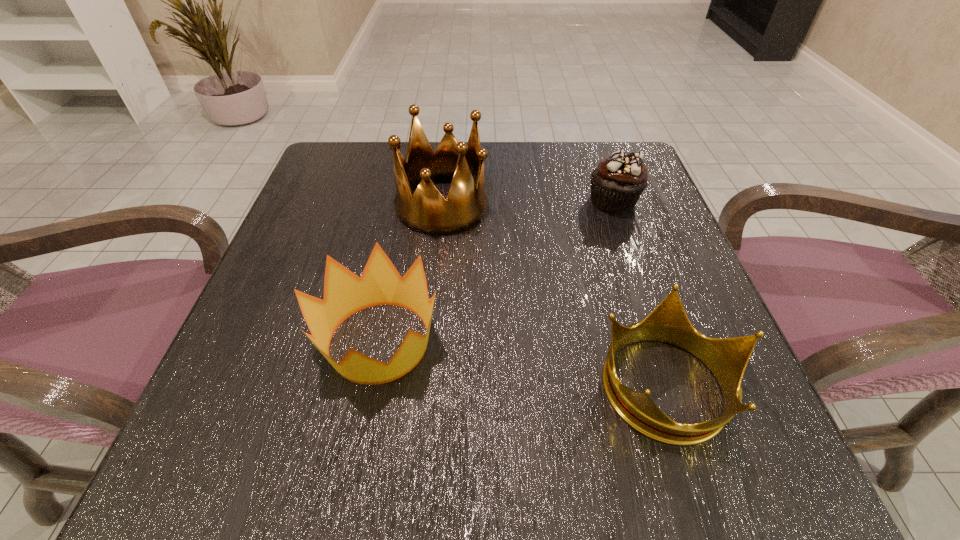
This screenshot has height=540, width=960. I want to click on vacant space at the near right corner, so click(653, 478).

You are a GUI agent. You are given a task and a screenshot of the screen. Output one action in this format:
    pyautogui.click(x=<x>, y=<y>)
    Task: Click on the free point between the cupcake and the rightmost crown
    
    Given the screenshot: What is the action you would take?
    pyautogui.click(x=639, y=292)

Find the location of a particular element. free area in between the cupcake and the rightmost crown is located at coordinates (639, 292).

The image size is (960, 540). I want to click on free spot between the rightmost crown and the cupcake, so click(639, 292).

You are a GUI agent. You are given a task and a screenshot of the screen. Output one action in this format:
    pyautogui.click(x=<x>, y=<y>)
    Task: Click on the unoccupied position between the cupcake and the farthest crown
    
    Given the screenshot: What is the action you would take?
    pyautogui.click(x=527, y=203)

Find the location of a particular element. This screenshot has width=960, height=540. vacant point located between the rightmost crown and the cupcake is located at coordinates (639, 292).

This screenshot has width=960, height=540. What are the coordinates of `object that stands as the closest to the cupcake` in the screenshot? It's located at [x=426, y=211].

Identify the location of object that is the second closest one to the cupcake. (727, 358).

Locate which crown ranks third in proximity to the cupcake. Please provide its 2D coordinates. Your answer should be formatted as a tuple, i.e. [(x, y)], where the tuple contains the x and y coordinates of a point satisfying the conditions above.

[(345, 293)]

This screenshot has width=960, height=540. What are the coordinates of `the closest crown to the rightmost crown` in the screenshot? It's located at (345, 293).